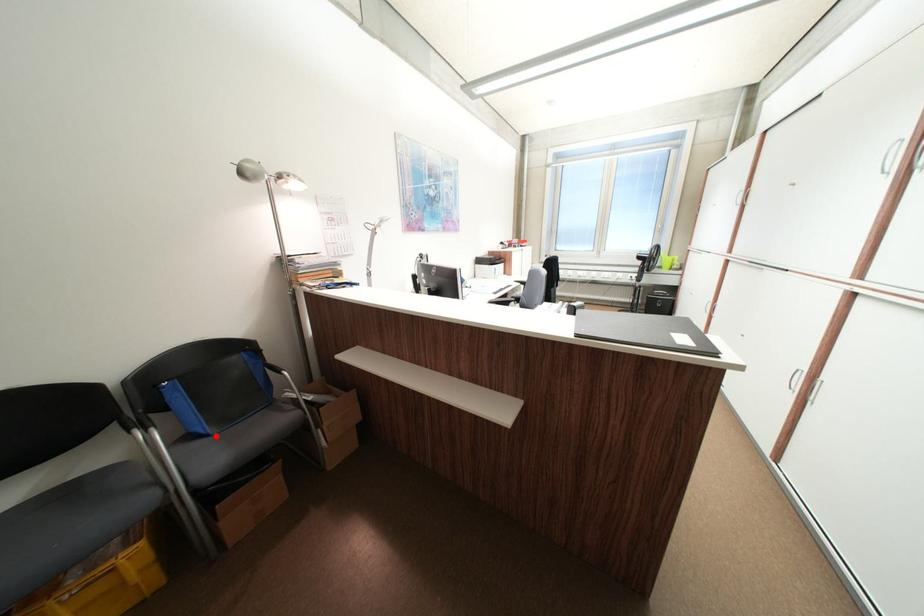
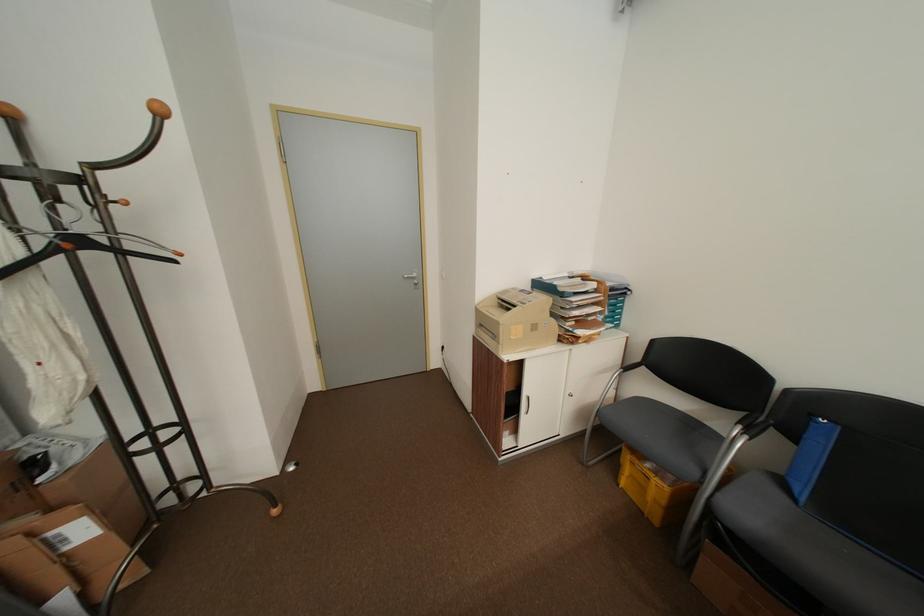
Locate, in the second image, the point that corresponds to the highlighted location in the first image.

(804, 500)